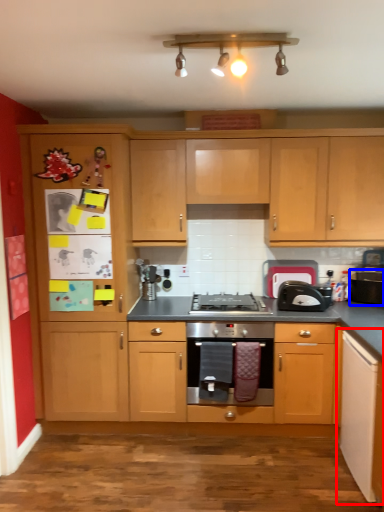
Question: Among these objects, which one is farthest to the camera, cabinetry (highlighted by a red box) or appliance (highlighted by a blue box)?

Choices:
 (A) cabinetry
 (B) appliance

Answer: (B)